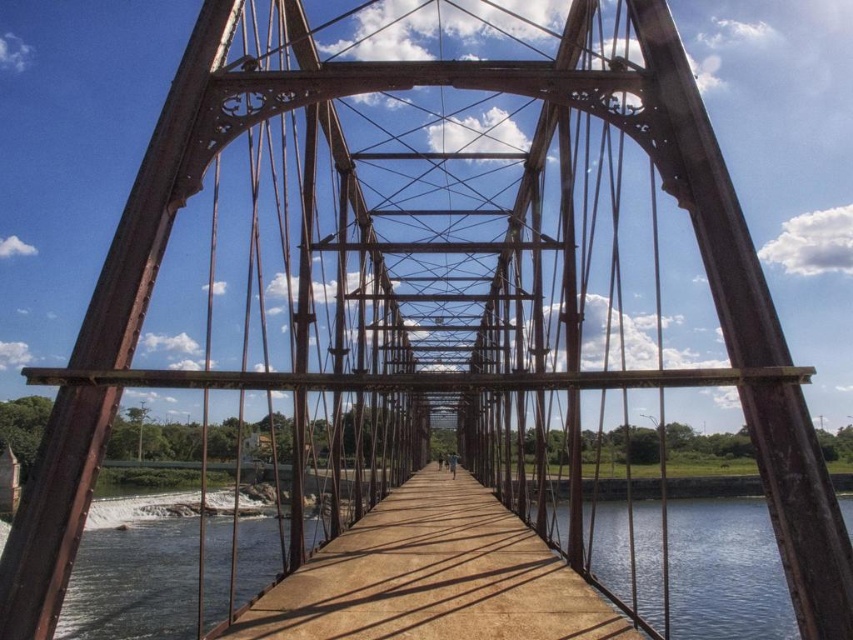
You are standing on the bridge and want to know which object is higher. According to the scene, which one is taller between the smooth concrete river at center and the brown wooden bridge at center?

The smooth concrete river at center is taller than the brown wooden bridge at center.

You are standing on the bridge and want to take a photo of the smooth concrete river at center and the brown wooden bridge at center. Which object should you focus on first if you want to capture both in a single shot without moving the camera?

You should focus on the brown wooden bridge at center first because it is closer to you than the smooth concrete river at center, allowing both to be in focus within the same frame.

You are standing on the metal truss bridge and want to walk towards the far end. You notice two points marked on the bridge deck at coordinates point (643,509) and point (608,616). Which point should you step on first if you want to reach the far end of the bridge as quickly as possible?

You should step on point (643,509) first because it is closer to you than point (608,616), which is further away. Since you want to reach the far end quickly, starting with the closer point will allow you to progress towards the end more efficiently.